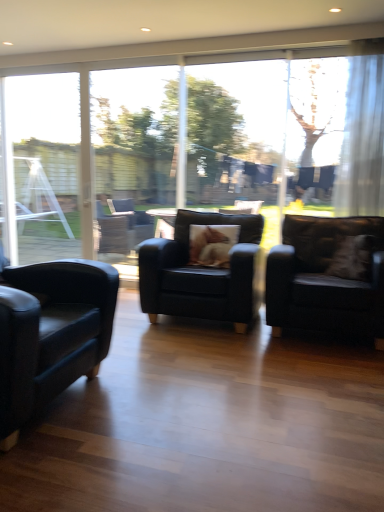
The height and width of the screenshot is (512, 384). In order to click on vacant area that lies in front of matte black armchair at center, the second chair from the right in this screenshot , I will do `click(231, 360)`.